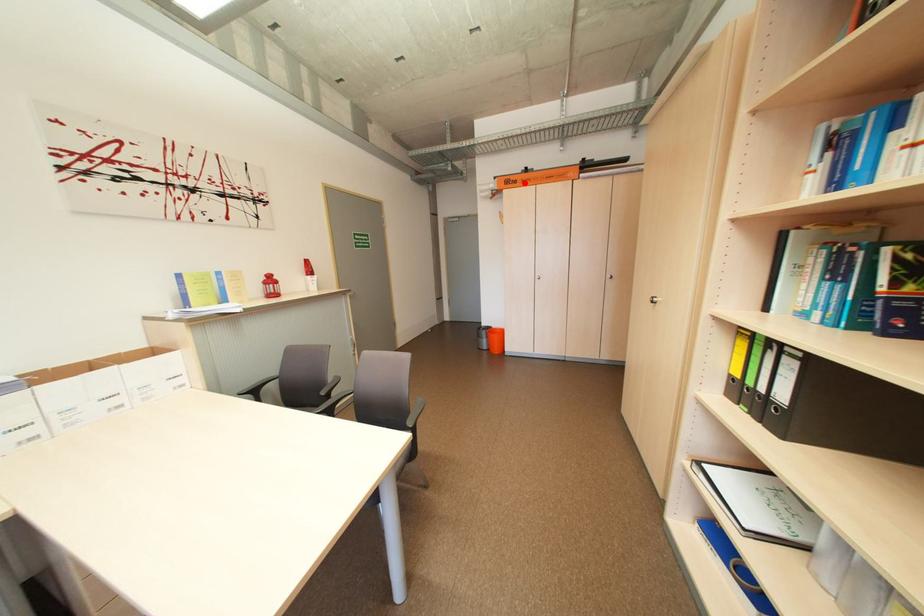
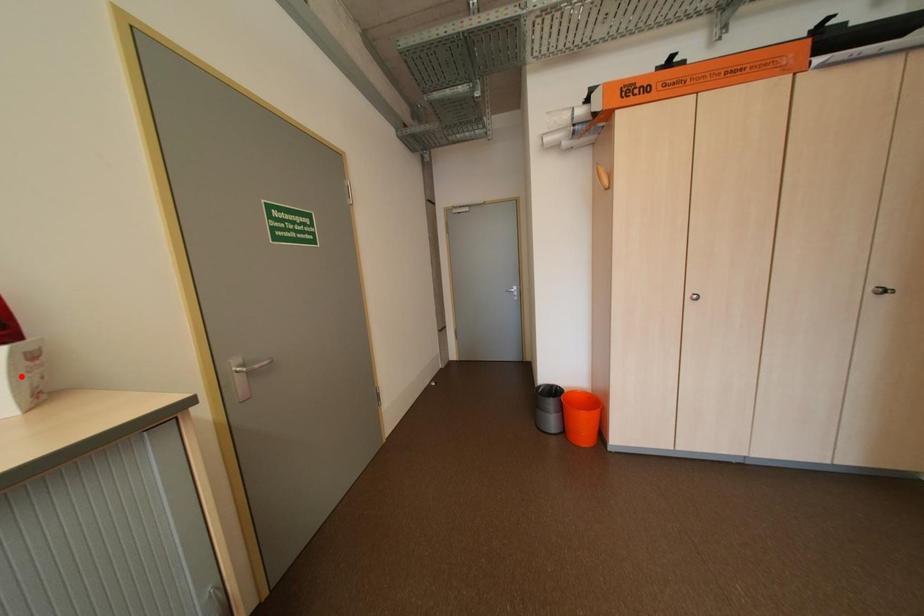
I am providing you with two images of the same scene from different viewpoints. A red point is marked on the first image and another point is marked on the second image. Do the highlighted points in image1 and image2 indicate the same real-world spot?

No